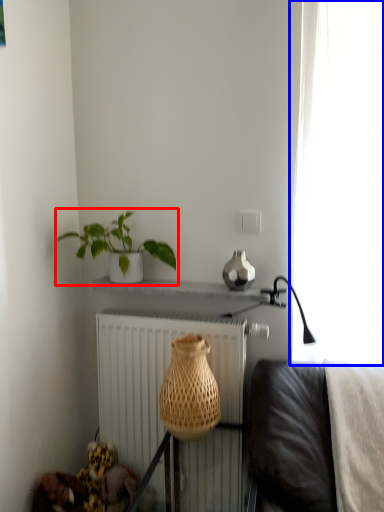
Question: Which of the following is the closest to the observer, houseplant (highlighted by a red box) or curtain (highlighted by a blue box)?

Choices:
 (A) houseplant
 (B) curtain

Answer: (B)